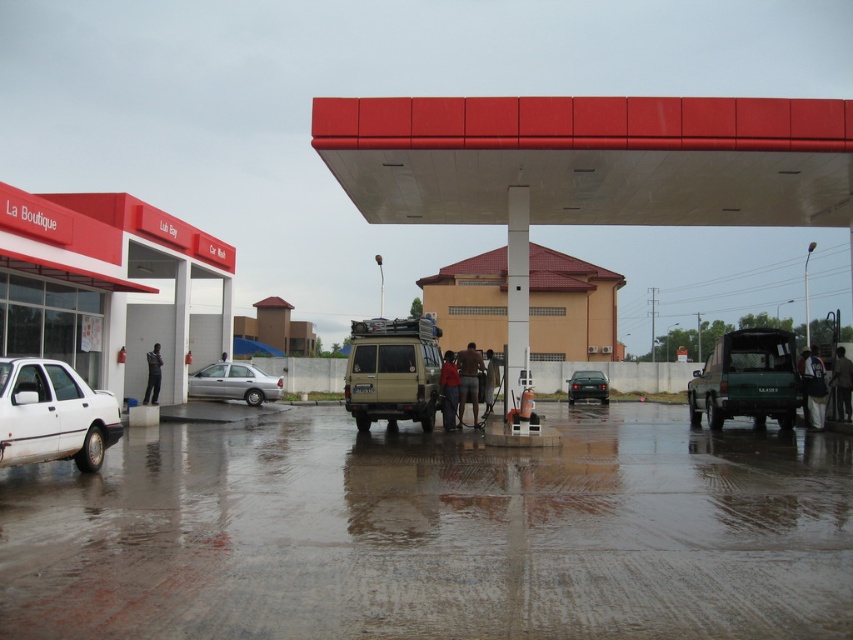
What do you see at coordinates (53, 413) in the screenshot? I see `white matte car at lower left` at bounding box center [53, 413].

Is white matte car at lower left below red fabric shirt at center?

Indeed, white matte car at lower left is positioned under red fabric shirt at center.

Locate an element on the screen. The height and width of the screenshot is (640, 853). white matte car at lower left is located at coordinates (53, 413).

Who is more forward, (270, 388) or (483, 397)?

Point (483, 397) is more forward.

Can you confirm if satin silver sedan at center is smaller than dark gray fabric pants at center?

Correct, satin silver sedan at center occupies less space than dark gray fabric pants at center.

Does point (262, 376) come closer to viewer compared to point (488, 353)?

No, (262, 376) is behind (488, 353).

The height and width of the screenshot is (640, 853). Find the location of `satin silver sedan at center`. satin silver sedan at center is located at coordinates (234, 384).

Is matte beige jeep at center in front of brown textured shorts at center?

Yes, it is.

Does matte beige jeep at center appear on the right side of brown textured shorts at center?

In fact, matte beige jeep at center is to the left of brown textured shorts at center.

Between point (393, 328) and point (473, 426), which one is positioned behind?

The point (473, 426) is behind.

The image size is (853, 640). What are the coordinates of `matte beige jeep at center` in the screenshot? It's located at (392, 371).